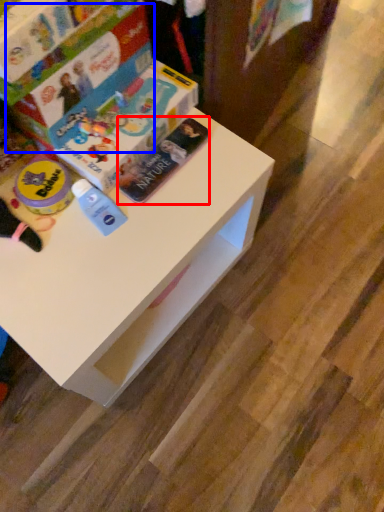
Question: Which object is closer to the camera taking this photo, paperback book (highlighted by a red box) or paperback book (highlighted by a blue box)?

Choices:
 (A) paperback book
 (B) paperback book

Answer: (B)